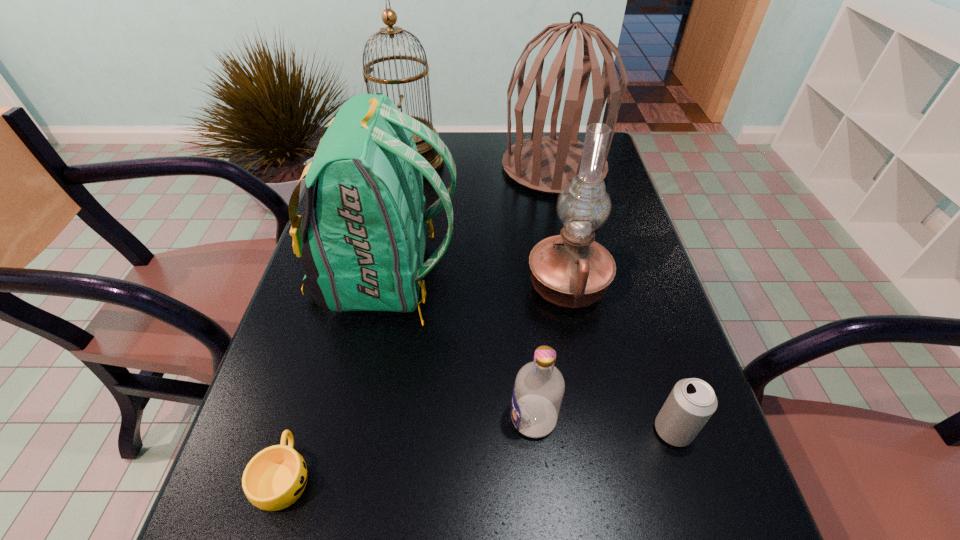
What are the coordinates of `oil lamp at the right edge` in the screenshot? It's located at (571, 270).

The image size is (960, 540). I want to click on beer can located at the right edge, so click(691, 403).

At what (x,y) coordinates should I click in order to perform the action: click on object located at the far left corner. Please return your answer as a coordinate pair (x, y). The image size is (960, 540). Looking at the image, I should click on (389, 17).

Locate an element on the screen. The image size is (960, 540). object located in the far right corner section of the desktop is located at coordinates (546, 164).

Identify the location of blank space at the far edge of the desktop. (499, 139).

You are a GUI agent. You are given a task and a screenshot of the screen. Output one action in this format:
    pyautogui.click(x=<x>, y=<y>)
    Task: Click on the free space at the left edge of the desktop
    Image resolution: width=960 pixels, height=540 pixels.
    Given the screenshot: What is the action you would take?
    pyautogui.click(x=293, y=315)

Where is `vacant region at the right edge of the desktop`? The height and width of the screenshot is (540, 960). vacant region at the right edge of the desktop is located at coordinates (640, 318).

The width and height of the screenshot is (960, 540). Identify the location of free space between the backpack and the vodka. (460, 348).

Identify the location of vacant space that is in between the fifth tallest object and the shortest object. This screenshot has width=960, height=540. (409, 447).

Identify the location of free space between the left birdcage and the cup. The height and width of the screenshot is (540, 960). (347, 320).